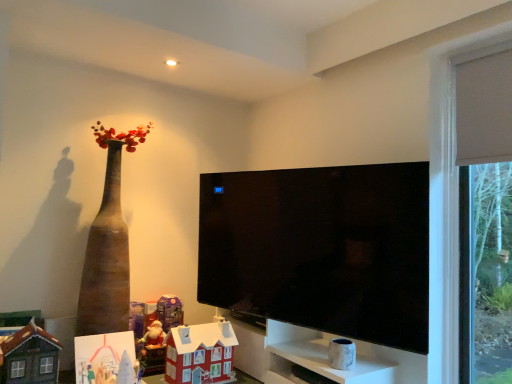
This screenshot has height=384, width=512. Identify the location of free location to the right of white marble vase at lower center, which is counted as the 6th toy, starting from the left. (376, 365).